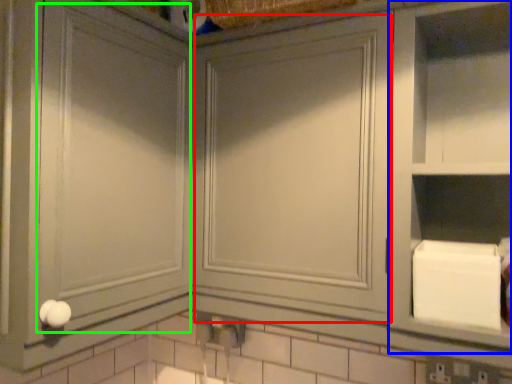
Question: Which object is positioned closest to glass door (highlighted by a red box)? Select from cabinet (highlighted by a blue box) and glass door (highlighted by a green box).

Choices:
 (A) cabinet
 (B) glass door

Answer: (A)